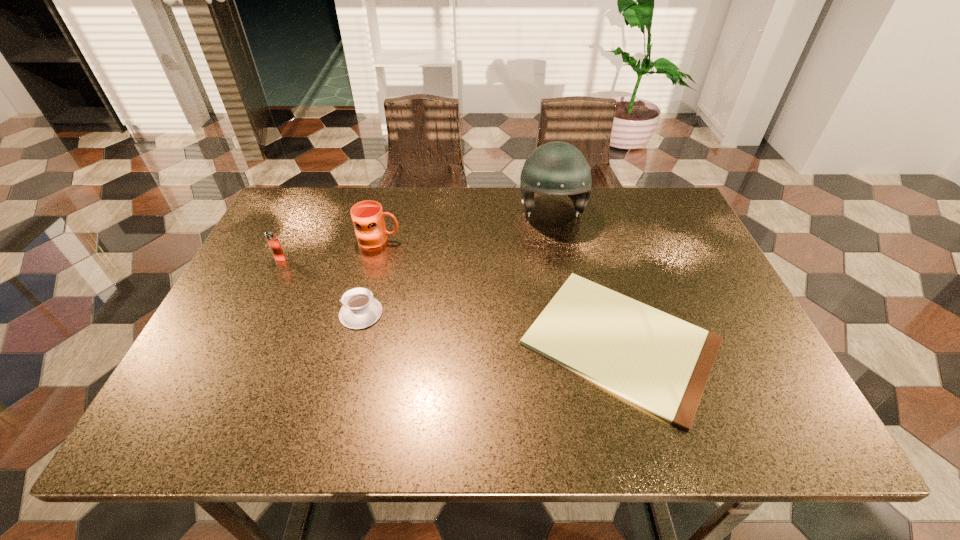
Where is `football helmet`? The height and width of the screenshot is (540, 960). football helmet is located at coordinates (556, 168).

Where is `mug`? Image resolution: width=960 pixels, height=540 pixels. mug is located at coordinates (367, 216).

At what (x,y) coordinates should I click in order to perform the action: click on the leftmost object. Please return your answer as a coordinate pair (x, y). Looking at the image, I should click on (272, 239).

At what (x,y) coordinates should I click in order to perform the action: click on igniter. Please return your answer as a coordinate pair (x, y). Image resolution: width=960 pixels, height=540 pixels. Looking at the image, I should click on (272, 239).

Locate an element on the screen. teacup is located at coordinates (360, 310).

Find the location of a particular element. The image size is (960, 540). the shortest object is located at coordinates [661, 363].

At what (x,y) coordinates should I click in order to perform the action: click on free space located at the face opening of the tallest object. Please return your answer as a coordinate pair (x, y). Image resolution: width=960 pixels, height=540 pixels. Looking at the image, I should click on (573, 321).

At what (x,y) coordinates should I click in order to perform the action: click on free space located on the handle side of the mug. Please return your answer as a coordinate pair (x, y). This screenshot has width=960, height=540. Looking at the image, I should click on (444, 239).

Identify the location of vacant space located 0.240m on the right of the third shortest object. (376, 259).

Locate an element on the screen. The image size is (960, 540). free space located 0.050m on the handle side of the teacup is located at coordinates (319, 313).